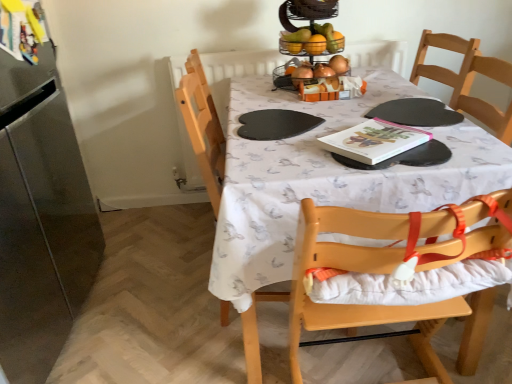
Locate an element on the screen. The height and width of the screenshot is (384, 512). free spot to the left of hardcover book at center is located at coordinates (300, 154).